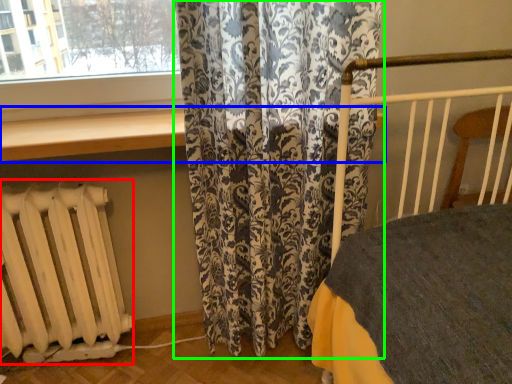
Question: Which object is the farthest from radiator (highlighted by a red box)? Choose among these: window sill (highlighted by a blue box) or curtain (highlighted by a green box).

Choices:
 (A) window sill
 (B) curtain

Answer: (B)